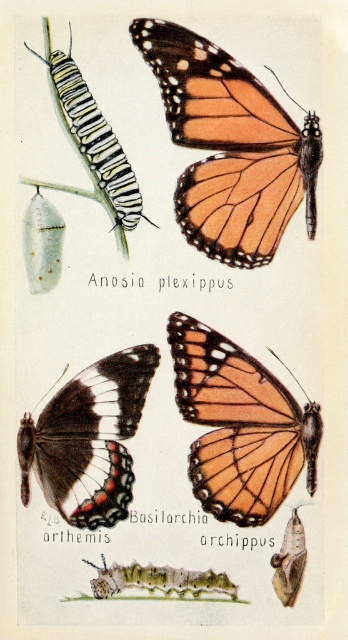
Question: Which object is farther from the camera taking this photo?

Choices:
 (A) green fuzzy caterpillar at lower center
 (B) white striped caterpillar at upper left
 (C) orange-patterned wings at center
 (D) orange matte butterfly at center

Answer: (D)

Question: Which of the following is the farthest from the observer?

Choices:
 (A) (99, 168)
 (B) (106, 584)

Answer: (A)

Question: In this image, where is black velvet butterfly at lower left located relative to white striped caterpillar at upper left?

Choices:
 (A) below
 (B) above

Answer: (A)

Question: Is black velvet butterfly at lower left below white striped caterpillar at upper left?

Choices:
 (A) yes
 (B) no

Answer: (A)

Question: Which point is farther from the camera taking this photo?

Choices:
 (A) (72, 476)
 (B) (243, 356)
 (C) (175, 576)

Answer: (B)

Question: Can you confirm if orange-patterned wings at center is positioned below white striped caterpillar at upper left?

Choices:
 (A) no
 (B) yes

Answer: (A)